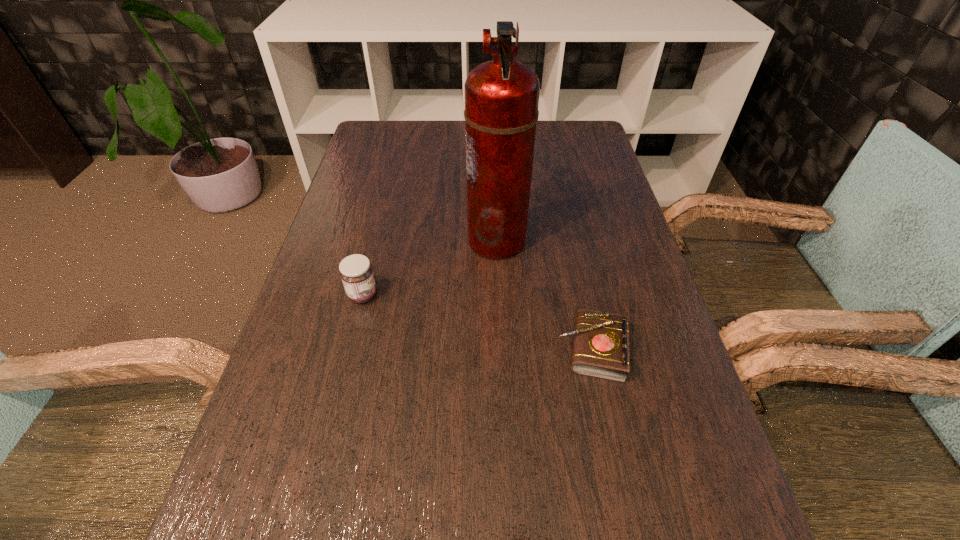
Find the location of `vacant position in the image that satisfies the following two spatial constraints: 1. on the side of the tallest object with the handle and hose; 2. on the left side of the rightmost object`. vacant position in the image that satisfies the following two spatial constraints: 1. on the side of the tallest object with the handle and hose; 2. on the left side of the rightmost object is located at coordinates point(501,349).

What are the coordinates of `vacant position in the image that satisfies the following two spatial constraints: 1. on the front label of the rightmost object; 2. on the right side of the jam` in the screenshot? It's located at (349, 349).

Identify the location of vacant area that satisfies the following two spatial constraints: 1. on the side of the nearest object with the handle and hose; 2. on the right side of the second object from right to left. (501, 349).